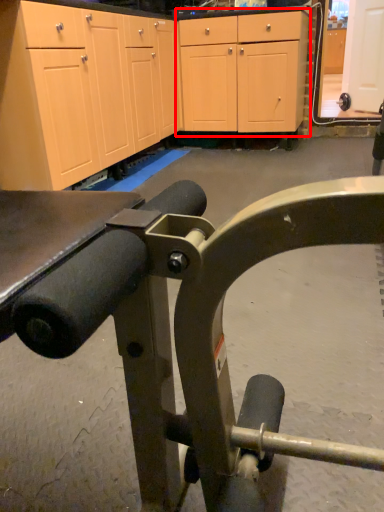
Question: From the image's perspective, what is the correct spatial relationship of cabinetry (annotated by the red box) in relation to cabinetry?

Choices:
 (A) above
 (B) below

Answer: (B)